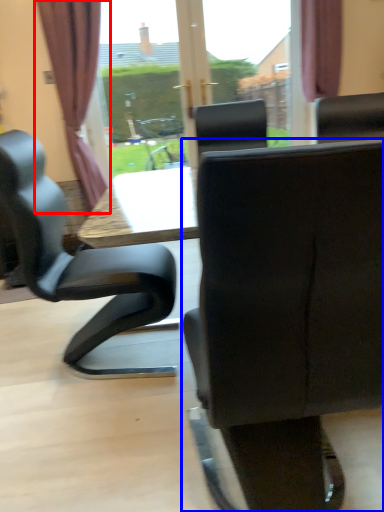
Question: Which point is closer to the camera, curtain (highlighted by a red box) or chair (highlighted by a blue box)?

Choices:
 (A) curtain
 (B) chair

Answer: (B)